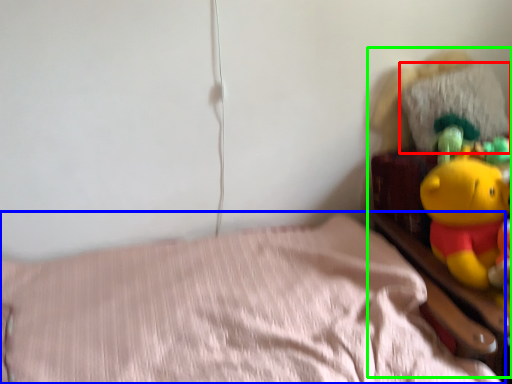
Question: Considering the real-world distances, which object is farthest from pillow (highlighted by a red box)? bed (highlighted by a blue box) or toy (highlighted by a green box)?

Choices:
 (A) bed
 (B) toy

Answer: (A)